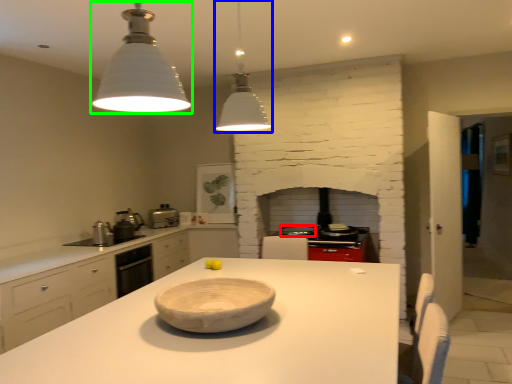
Question: Which is nearer to the appliance (highlighted by a red box)? light fixture (highlighted by a blue box) or light fixture (highlighted by a green box).

Choices:
 (A) light fixture
 (B) light fixture

Answer: (A)